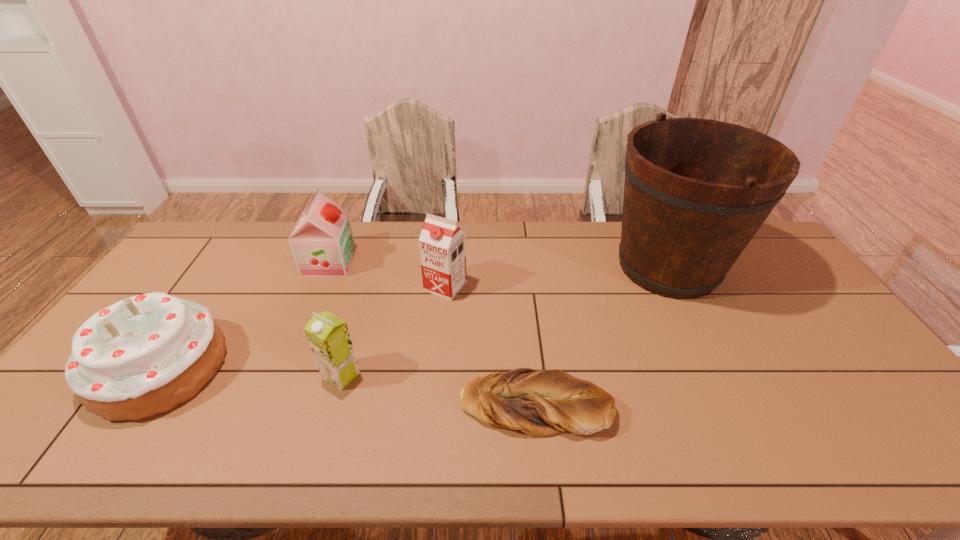
You are a GUI agent. You are given a task and a screenshot of the screen. Output one action in this format:
    pyautogui.click(x=<x>, y=<y>)
    Task: Click on the blank region between the cake and the shortest object
    
    Given the screenshot: What is the action you would take?
    pyautogui.click(x=348, y=386)

You are a GUI agent. You are given a task and a screenshot of the screen. Output one action in this format:
    pyautogui.click(x=<x>, y=<y>)
    Task: Click on the unoccupied area between the cake and the rightmost object
    The width and height of the screenshot is (960, 540).
    Given the screenshot: What is the action you would take?
    pyautogui.click(x=415, y=317)

Locate which object is the fifth closest to the second soya milk from right to left. Please provide its 2D coordinates. Your answer should be formatted as a tuple, i.e. [(x, y)], where the tuple contains the x and y coordinates of a point satisfying the conditions above.

[(696, 191)]

Choose which object is the second nearest neighbor to the bread. Please provide its 2D coordinates. Your answer should be formatted as a tuple, i.e. [(x, y)], where the tuple contains the x and y coordinates of a point satisfying the conditions above.

[(328, 336)]

Select which soya milk appears as the third closest to the bread. Please provide its 2D coordinates. Your answer should be formatted as a tuple, i.e. [(x, y)], where the tuple contains the x and y coordinates of a point satisfying the conditions above.

[(322, 243)]

Select which soya milk appears as the closest to the rightmost object. Please provide its 2D coordinates. Your answer should be formatted as a tuple, i.e. [(x, y)], where the tuple contains the x and y coordinates of a point satisfying the conditions above.

[(442, 245)]

This screenshot has width=960, height=540. Identify the location of blank space that satisfies the following two spatial constraints: 1. with the cap open on the leftmost soya milk; 2. on the back side of the nearest soya milk. (283, 375).

Find the location of `vacant space that satisfies the following two spatial constraints: 1. with the cap open on the tallest object; 2. on the left side of the leftmost soya milk`. vacant space that satisfies the following two spatial constraints: 1. with the cap open on the tallest object; 2. on the left side of the leftmost soya milk is located at coordinates (327, 267).

The width and height of the screenshot is (960, 540). Find the location of `vacant space that satisfies the following two spatial constraints: 1. on the back side of the cake; 2. on the right side of the rightmost object`. vacant space that satisfies the following two spatial constraints: 1. on the back side of the cake; 2. on the right side of the rightmost object is located at coordinates (228, 267).

Locate an element on the screen. The width and height of the screenshot is (960, 540). free point that satisfies the following two spatial constraints: 1. with the cap open on the rightmost soya milk; 2. on the right side of the fifth object from right to left is located at coordinates (320, 286).